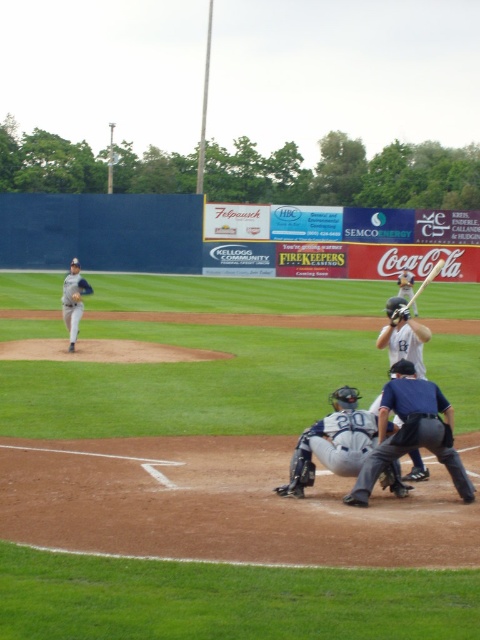
Question: Which of the following is the farthest from the observer?

Choices:
 (A) gray matte uniform at center
 (B) matte gray helmet at upper center
 (C) gray uniformed pitcher at left

Answer: (B)

Question: Is the position of gray uniformed pitcher at left more distant than that of matte gray helmet at upper center?

Choices:
 (A) yes
 (B) no

Answer: (B)

Question: From the image, what is the correct spatial relationship of matte gray helmet at upper center in relation to wooden baseball bat at center?

Choices:
 (A) right
 (B) left

Answer: (A)

Question: Which object appears closest to the camera in this image?

Choices:
 (A) gray matte uniform at center
 (B) wooden baseball bat at center

Answer: (A)

Question: Where is white matte baseball bat at center located in relation to brown leather glove at center in the image?

Choices:
 (A) below
 (B) above

Answer: (A)

Question: Which point is farther to the camera?

Choices:
 (A) brown leather glove at center
 (B) white matte baseball bat at center
 (C) gray uniformed pitcher at left
 (D) blue uniform at lower center

Answer: (C)